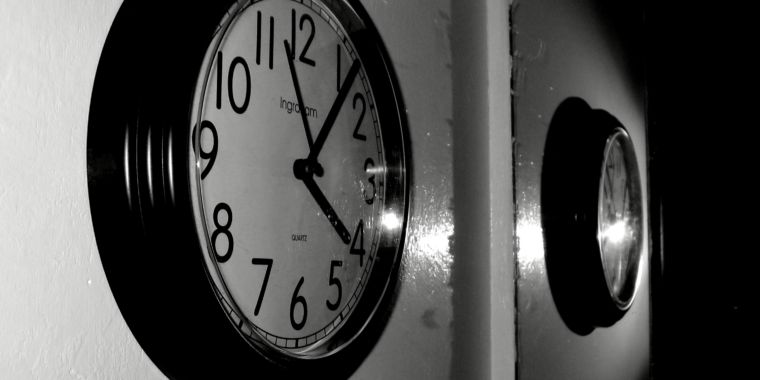
Identify the location of brand of clock. The width and height of the screenshot is (760, 380). (287, 105), (299, 238).